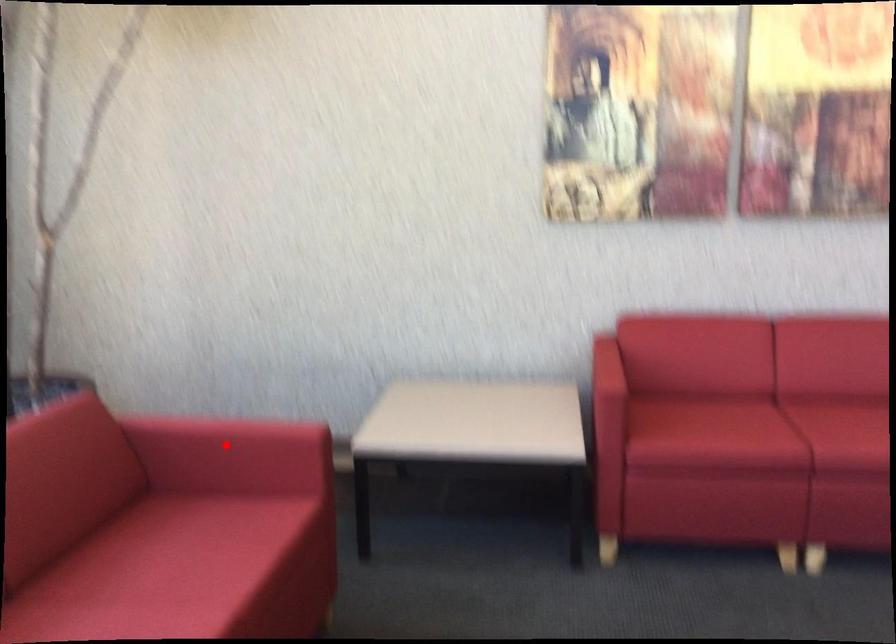
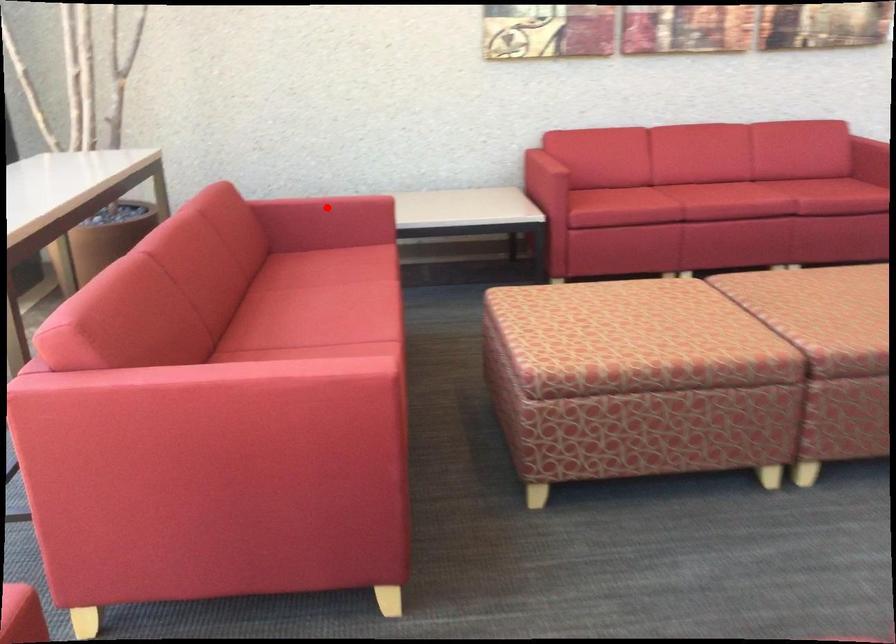
I am providing you with two images of the same scene from different viewpoints. A red point is marked on the first image and another point is marked on the second image. Is the marked point in image1 the same physical position as the marked point in image2?

Yes